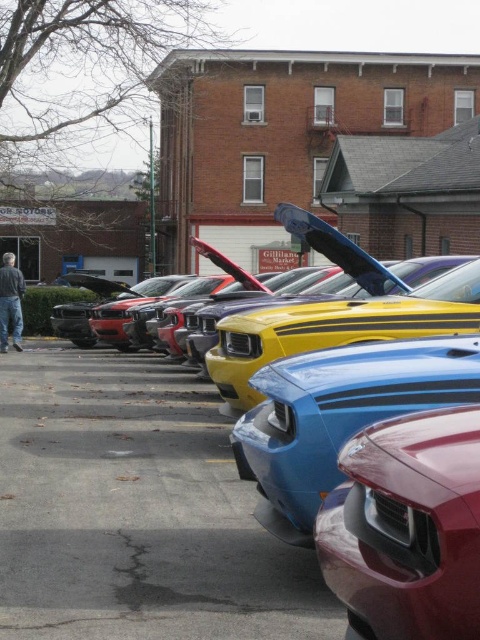
You are standing at the camera position and looking at the row of cars. There are two points marked in the image at coordinates point (x=144, y=500) and point (x=63, y=372). Which point is physically closer to you?

Point (x=144, y=500) is closer to the camera than point (x=63, y=372), so the point at (x=144, y=500) is physically closer to you.

You are at a car show and want to take a photo of both the yellow glossy car at center and the blue glossy car at center. Since you want to include both cars in the same frame, which car should you position closer to the camera to ensure both fit?

To include both the yellow glossy car at center and the blue glossy car at center in the same frame, you should position the yellow glossy car at center closer to the camera. Since it is bigger, moving it closer will help balance their sizes in the photo.